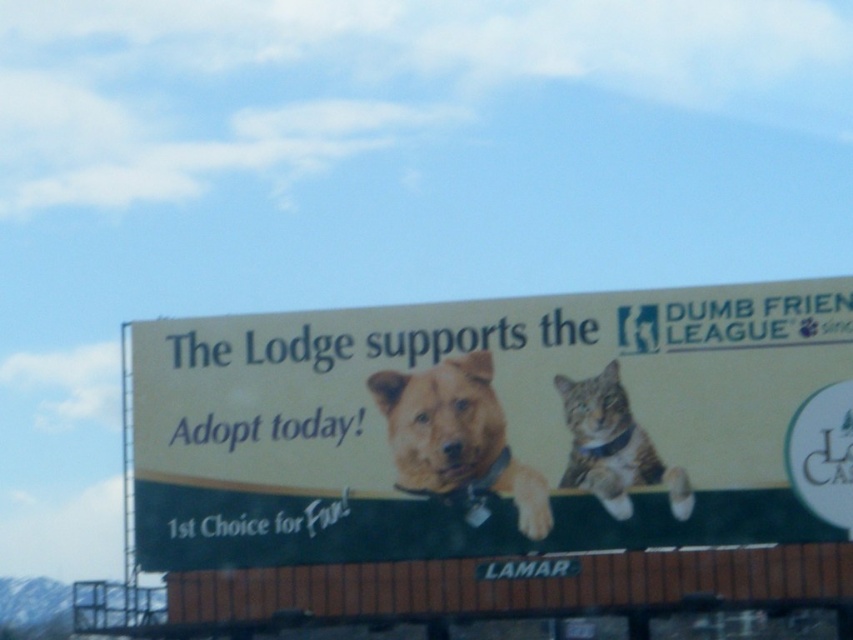
Is white paper billboard at center to the left of tabby fur cat at center from the viewer's perspective?

Indeed, white paper billboard at center is positioned on the left side of tabby fur cat at center.

Is point (160, 476) farther from camera compared to point (595, 413)?

Yes, it is.

You are a GUI agent. You are given a task and a screenshot of the screen. Output one action in this format:
    pyautogui.click(x=<x>, y=<y>)
    Task: Click on the white paper billboard at center
    This screenshot has height=640, width=853.
    Given the screenshot: What is the action you would take?
    pyautogui.click(x=495, y=428)

Is brown fur dog at center shorter than tabby fur cat at center?

Correct, brown fur dog at center is not as tall as tabby fur cat at center.

Measure the distance between point (421, 381) and camera.

They are 108.55 meters apart.

Which is behind, point (426, 433) or point (616, 376)?

Positioned behind is point (426, 433).

Find the location of a particular element. The width and height of the screenshot is (853, 640). brown fur dog at center is located at coordinates (457, 440).

Which is more to the right, white paper billboard at center or brown fur dog at center?

From the viewer's perspective, white paper billboard at center appears more on the right side.

Who is positioned more to the left, white paper billboard at center or brown fur dog at center?

From the viewer's perspective, brown fur dog at center appears more on the left side.

Is point (300, 547) closer to camera compared to point (463, 369)?

No, it is behind (463, 369).

Where is `white paper billboard at center`? Image resolution: width=853 pixels, height=640 pixels. white paper billboard at center is located at coordinates (495, 428).